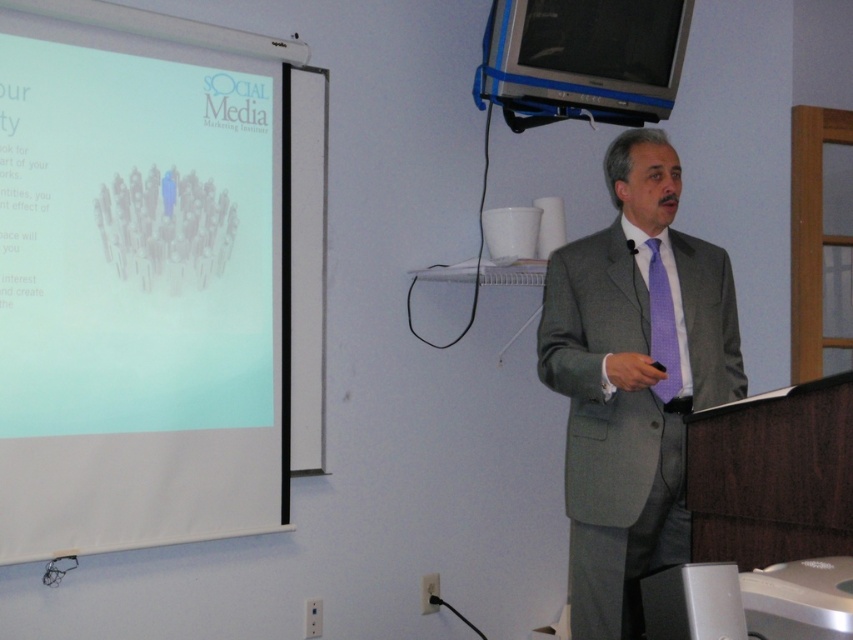
Question: Can you confirm if satin silver speaker at lower right is positioned above purple dotted tie at center?

Choices:
 (A) no
 (B) yes

Answer: (A)

Question: Which object appears closest to the camera in this image?

Choices:
 (A) white matte projection screen at left
 (B) gray suit at center

Answer: (B)

Question: From the image, what is the correct spatial relationship of white matte projection screen at left in relation to satin silver speaker at lower right?

Choices:
 (A) left
 (B) right

Answer: (A)

Question: Estimate the real-world distances between objects in this image. Which object is closer to the gray suit at center?

Choices:
 (A) white matte projection screen at left
 (B) satin silver speaker at lower right

Answer: (B)

Question: Which is farther from the satin silver speaker at lower right?

Choices:
 (A) white matte projection screen at left
 (B) purple dotted tie at center
 (C) gray suit at center

Answer: (A)

Question: Is white matte projection screen at left positioned behind gray suit at center?

Choices:
 (A) yes
 (B) no

Answer: (A)